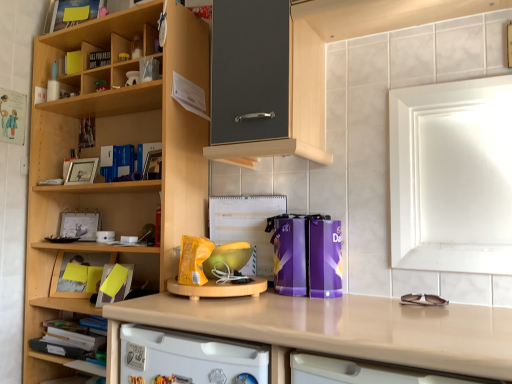
Question: Is yellow paper at left at the back of matte black photo frame at upper left, which appears as the second book when ordered from the bottom?

Choices:
 (A) yes
 (B) no

Answer: (B)

Question: From the image's perspective, is matte black photo frame at upper left, the 1th book in the back-to-front sequence, beneath yellow paper at left?

Choices:
 (A) no
 (B) yes

Answer: (A)

Question: Is matte black photo frame at upper left, which appears as the second book when ordered from the bottom, not inside yellow paper at left?

Choices:
 (A) no
 (B) yes

Answer: (B)

Question: Does matte black photo frame at upper left, which ranks as the fourth book in front-to-back order, turn towards yellow paper at left?

Choices:
 (A) no
 (B) yes

Answer: (A)

Question: Can you confirm if matte black photo frame at upper left, arranged as the 2th book when viewed from the left, is shorter than yellow paper at left?

Choices:
 (A) yes
 (B) no

Answer: (A)

Question: Is wooden cupboard at left in front of or behind yellow paper at lower left, which is the fourth book from left to right, in the image?

Choices:
 (A) front
 (B) behind

Answer: (A)

Question: Is wooden cupboard at left wider or thinner than yellow paper at lower left, the fourth book in the top-to-bottom sequence?

Choices:
 (A) wide
 (B) thin

Answer: (A)

Question: Does point (156, 91) appear closer or farther from the camera than point (120, 286)?

Choices:
 (A) closer
 (B) farther

Answer: (B)

Question: Which is correct: wooden cupboard at left is inside yellow paper at lower left, arranged as the 1th book when ordered from the bottom, or outside of it?

Choices:
 (A) inside
 (B) outside

Answer: (B)

Question: In terms of size, does white glossy medicine cabinet at upper right appear bigger or smaller than beige laminate countertop at center?

Choices:
 (A) small
 (B) big

Answer: (A)

Question: Considering the positions of white glossy medicine cabinet at upper right and beige laminate countertop at center in the image, is white glossy medicine cabinet at upper right taller or shorter than beige laminate countertop at center?

Choices:
 (A) short
 (B) tall

Answer: (B)

Question: Is white glossy medicine cabinet at upper right inside or outside of beige laminate countertop at center?

Choices:
 (A) inside
 (B) outside

Answer: (B)

Question: Considering the positions of point (437, 215) and point (279, 331), is point (437, 215) closer or farther from the camera than point (279, 331)?

Choices:
 (A) closer
 (B) farther

Answer: (B)

Question: Is matte black book at upper left, arranged as the third book when viewed from the left, in front of or behind beige laminate countertop at center in the image?

Choices:
 (A) behind
 (B) front

Answer: (A)

Question: In the image, is matte black book at upper left, which ranks as the third book in back-to-front order, on the left side or the right side of beige laminate countertop at center?

Choices:
 (A) right
 (B) left

Answer: (B)